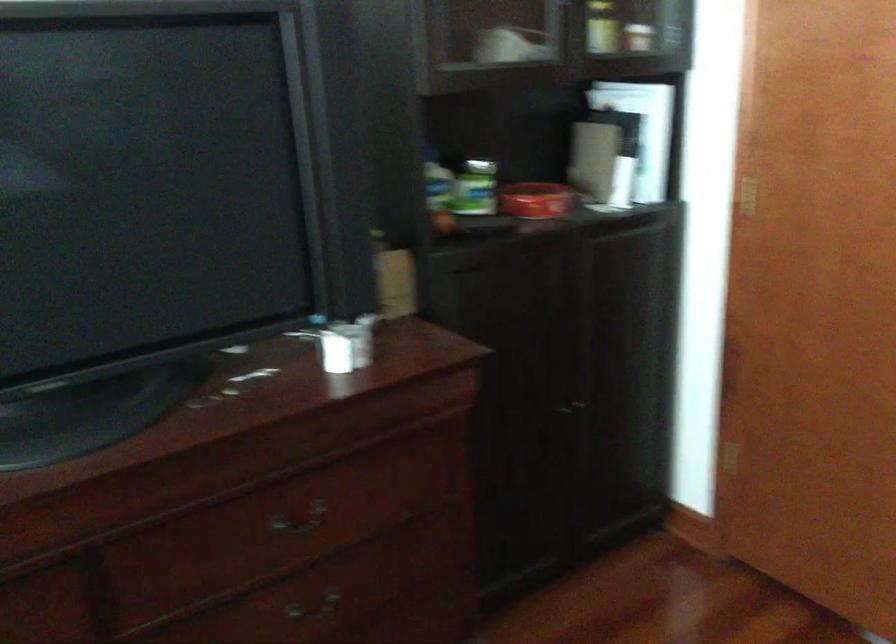
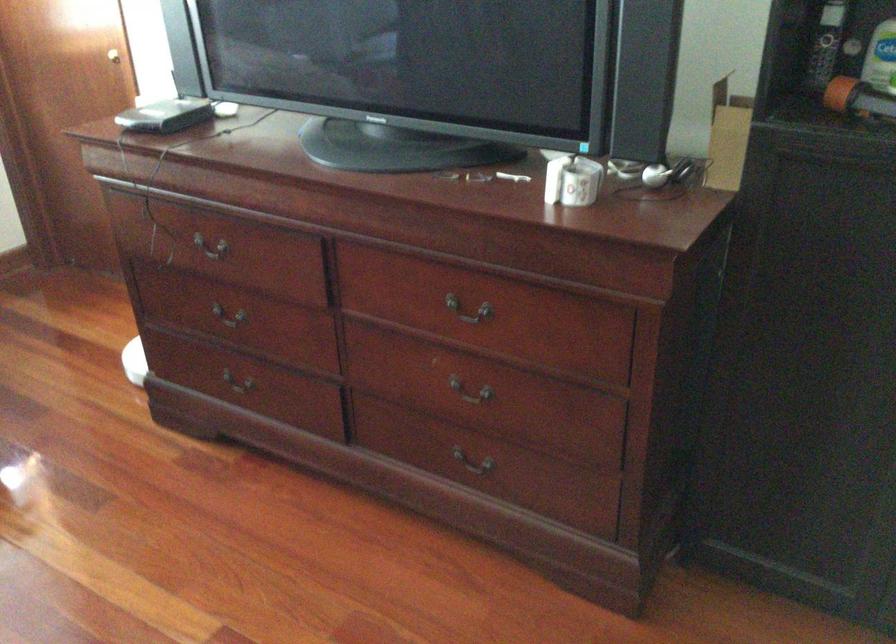
Where in the second image is the point corresponding to (426,205) from the first image?

(883, 77)